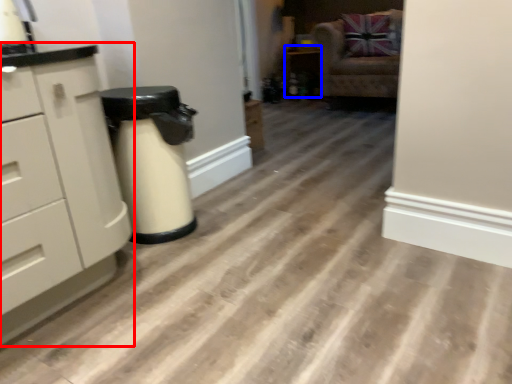
Question: Which point is further to the camera, chest of drawers (highlighted by a red box) or cabinetry (highlighted by a blue box)?

Choices:
 (A) chest of drawers
 (B) cabinetry

Answer: (B)